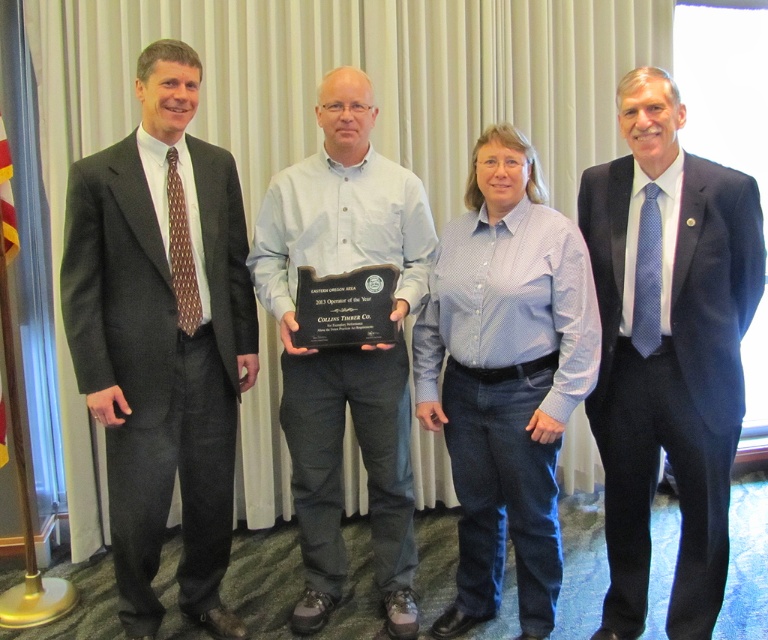
Is dark blue suit at right above blue cotton shirt at center?

Correct, dark blue suit at right is located above blue cotton shirt at center.

The height and width of the screenshot is (640, 768). In order to click on dark blue suit at right in this screenshot , I will do `click(667, 348)`.

Measure the distance between point [684,289] and camera.

Point [684,289] is 2.15 meters away from camera.

The width and height of the screenshot is (768, 640). In order to click on dark blue suit at right in this screenshot , I will do `click(667, 348)`.

Is dark gray suit at left shorter than blue cotton shirt at center?

Incorrect, dark gray suit at left's height does not fall short of blue cotton shirt at center's.

Which is above, dark gray suit at left or blue cotton shirt at center?

dark gray suit at left is higher up.

Between point (74, 184) and point (492, 576), which one is positioned behind?

The point (492, 576) is more distant.

Identify the location of dark gray suit at left. This screenshot has height=640, width=768. (161, 337).

Does dark gray suit at left have a larger size compared to dark blue suit at right?

Indeed, dark gray suit at left has a larger size compared to dark blue suit at right.

Does dark gray suit at left lie behind dark blue suit at right?

Yes, dark gray suit at left is further from the viewer.

Which is behind, point (237, 188) or point (687, 392)?

Positioned behind is point (237, 188).

This screenshot has height=640, width=768. Find the location of `dark gray suit at left`. dark gray suit at left is located at coordinates (161, 337).